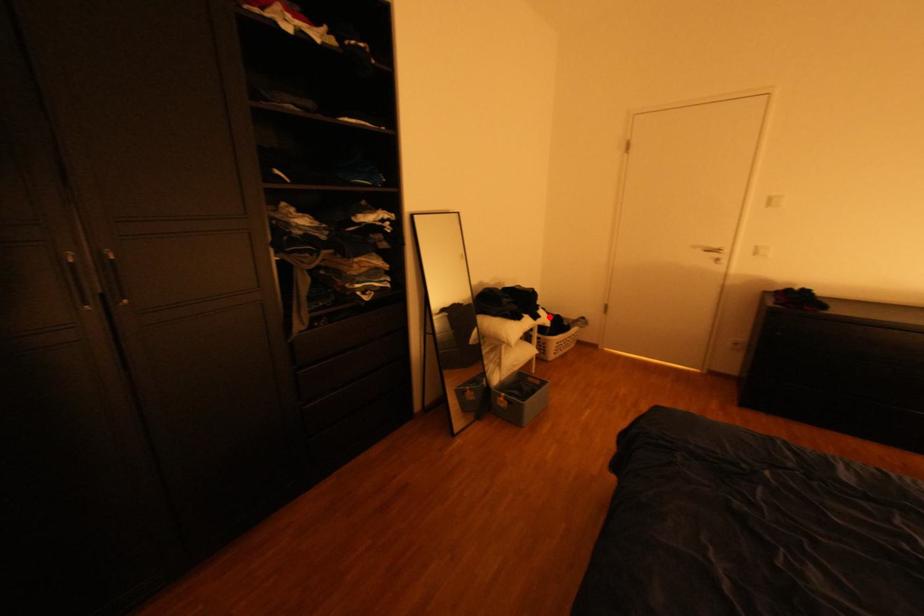
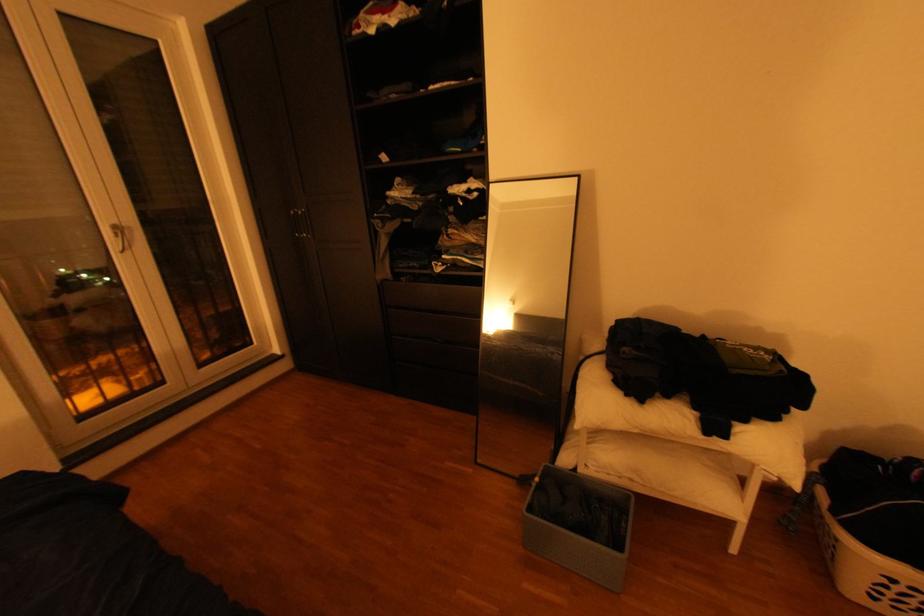
In the second image, find the point that corresponds to the highlighted location in the first image.

(735, 436)